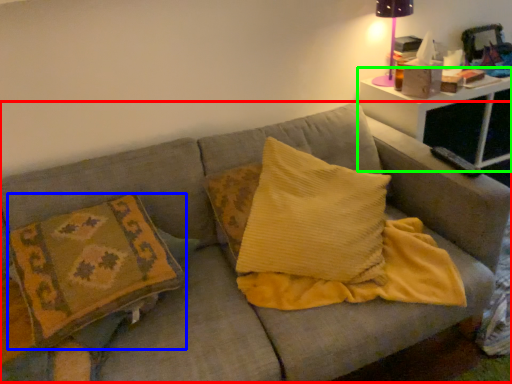
Question: Estimate the real-world distances between objects in this image. Which object is farther from couch (highlighted by a red box), pillow (highlighted by a blue box) or table (highlighted by a green box)?

Choices:
 (A) pillow
 (B) table

Answer: (B)